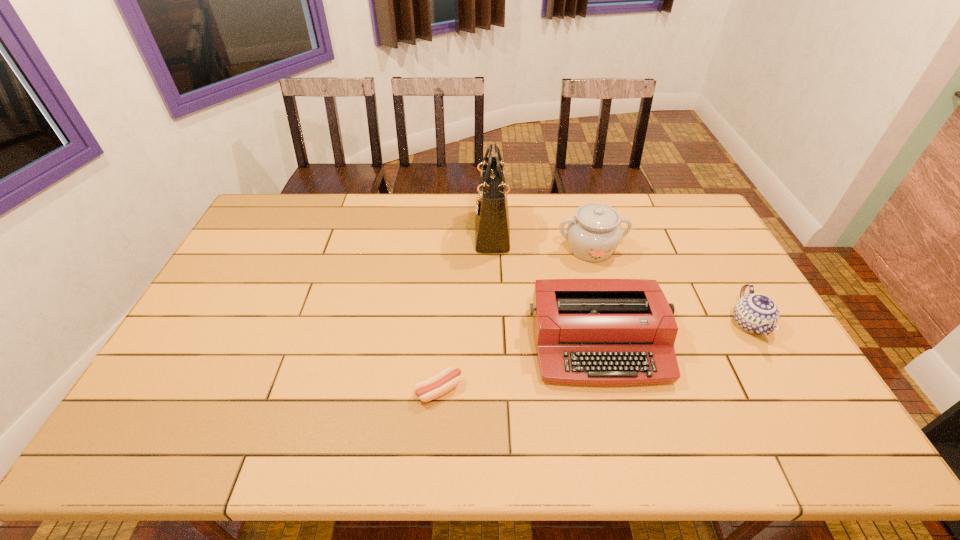
Identify the location of handbag. This screenshot has width=960, height=540. (492, 229).

You are a GUI agent. You are given a task and a screenshot of the screen. Output one action in this format:
    pyautogui.click(x=<x>, y=<y>)
    Task: Click on the second object from left to right
    Image resolution: width=960 pixels, height=540 pixels.
    Given the screenshot: What is the action you would take?
    pyautogui.click(x=492, y=229)

At what (x,y) coordinates should I click in order to perform the action: click on the taller chinaware. Please return your answer as a coordinate pair (x, y). Looking at the image, I should click on (593, 234).

This screenshot has width=960, height=540. I want to click on the farther chinaware, so click(593, 234).

This screenshot has width=960, height=540. In order to click on typewriter in this screenshot , I will do `click(609, 332)`.

This screenshot has width=960, height=540. What are the coordinates of `the rightmost object` in the screenshot? It's located at (757, 313).

You are a GUI agent. You are given a task and a screenshot of the screen. Output one action in this format:
    pyautogui.click(x=<x>, y=<y>)
    Task: Click on the nearer chinaware
    The width and height of the screenshot is (960, 540).
    Given the screenshot: What is the action you would take?
    pyautogui.click(x=757, y=313)

Image resolution: width=960 pixels, height=540 pixels. I want to click on the leftmost object, so click(x=432, y=388).

I want to click on the shortest object, so click(432, 388).

Where is `free spot located at the front of the tallest object with visible charms`? The width and height of the screenshot is (960, 540). free spot located at the front of the tallest object with visible charms is located at coordinates (369, 231).